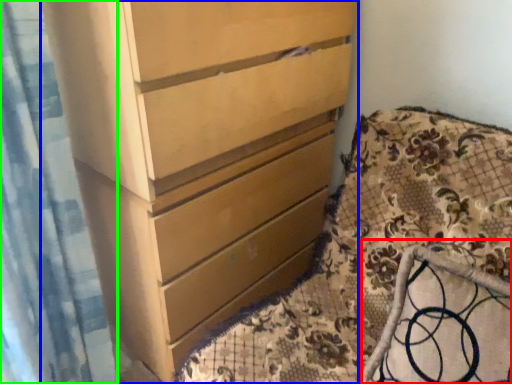
Question: Considering the real-world distances, which object is farthest from rocking chair (highlighted by a red box)? chest of drawers (highlighted by a blue box) or shower curtain (highlighted by a green box)?

Choices:
 (A) chest of drawers
 (B) shower curtain

Answer: (B)